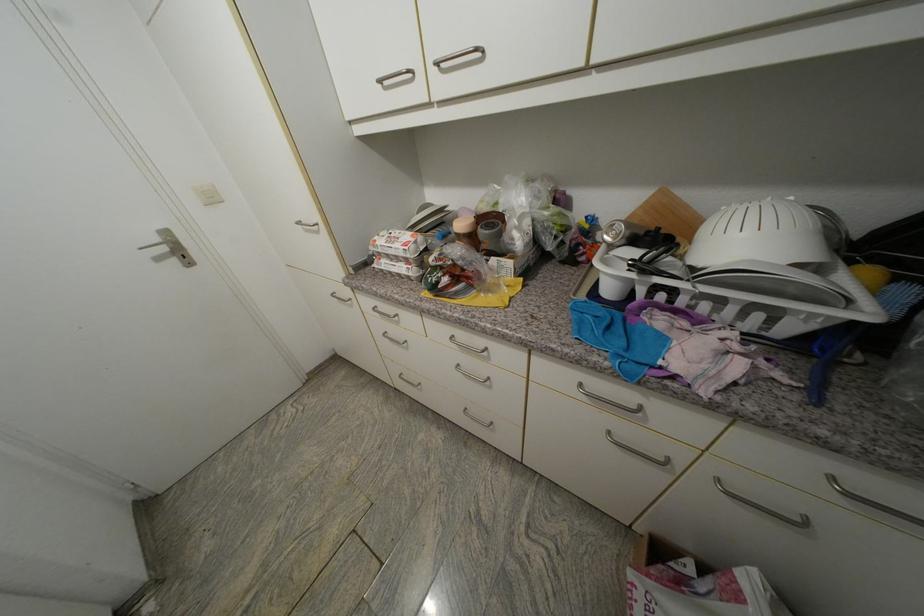
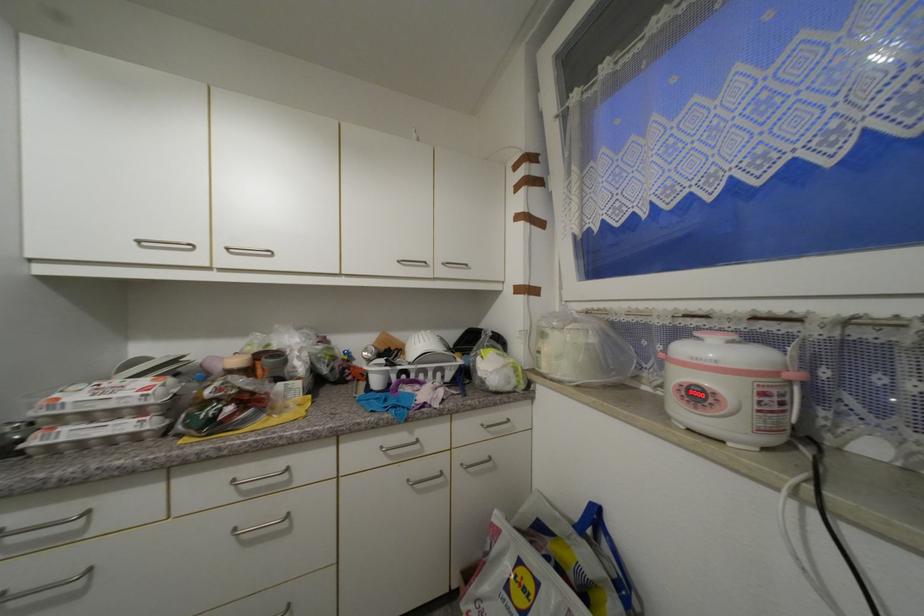
First-person continuous shooting, in which direction is the camera rotating?

The camera rotated toward right-up.